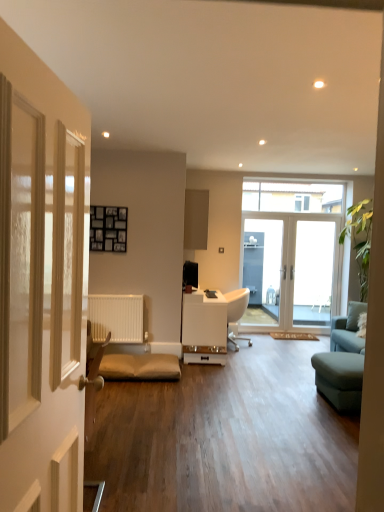
Question: Is white glossy door at center, which is the 1th door in back-to-front order, to the right of matte gray cabinet at upper center from the viewer's perspective?

Choices:
 (A) yes
 (B) no

Answer: (A)

Question: Is the position of white glossy door at center, which is the 1th door in back-to-front order, more distant than that of matte gray cabinet at upper center?

Choices:
 (A) no
 (B) yes

Answer: (B)

Question: Could you tell me if white glossy door at center, the first door positioned from the right, is turned towards matte gray cabinet at upper center?

Choices:
 (A) yes
 (B) no

Answer: (B)

Question: Is white glossy door at center, the first door positioned from the right, turned away from matte gray cabinet at upper center?

Choices:
 (A) no
 (B) yes

Answer: (A)

Question: From a real-world perspective, is white glossy door at center, which is the 1th door in back-to-front order, beneath matte gray cabinet at upper center?

Choices:
 (A) no
 (B) yes

Answer: (B)

Question: Considering the positions of white glossy door at center, the first door positioned from the right, and clear glass window at upper center in the image, is white glossy door at center, the first door positioned from the right, bigger or smaller than clear glass window at upper center?

Choices:
 (A) big
 (B) small

Answer: (A)

Question: In terms of width, does white glossy door at center, the second door when ordered from left to right, look wider or thinner when compared to clear glass window at upper center?

Choices:
 (A) wide
 (B) thin

Answer: (A)

Question: Considering their positions, is white glossy door at center, the second door when ordered from left to right, located in front of or behind clear glass window at upper center?

Choices:
 (A) front
 (B) behind

Answer: (A)

Question: From a real-world perspective, is white glossy door at center, which is the 1th door in back-to-front order, positioned above or below clear glass window at upper center?

Choices:
 (A) below
 (B) above

Answer: (A)

Question: Is white glossy door at left, placed as the 2th door when sorted from back to front, taller or shorter than clear glass window at upper center?

Choices:
 (A) tall
 (B) short

Answer: (A)

Question: Is white glossy door at left, which is the second door in right-to-left order, wider or thinner than clear glass window at upper center?

Choices:
 (A) thin
 (B) wide

Answer: (B)

Question: In terms of size, does white glossy door at left, the 1th door from the left, appear bigger or smaller than clear glass window at upper center?

Choices:
 (A) small
 (B) big

Answer: (B)

Question: Would you say white glossy door at left, the 1th door from the left, is inside or outside clear glass window at upper center?

Choices:
 (A) outside
 (B) inside

Answer: (A)

Question: Visually, is white glossy door at center, the second door when ordered from left to right, positioned to the left or to the right of matte gray cabinet at upper center?

Choices:
 (A) left
 (B) right

Answer: (B)

Question: Looking at the image, does white glossy door at center, the second door from the front, seem bigger or smaller compared to matte gray cabinet at upper center?

Choices:
 (A) big
 (B) small

Answer: (B)